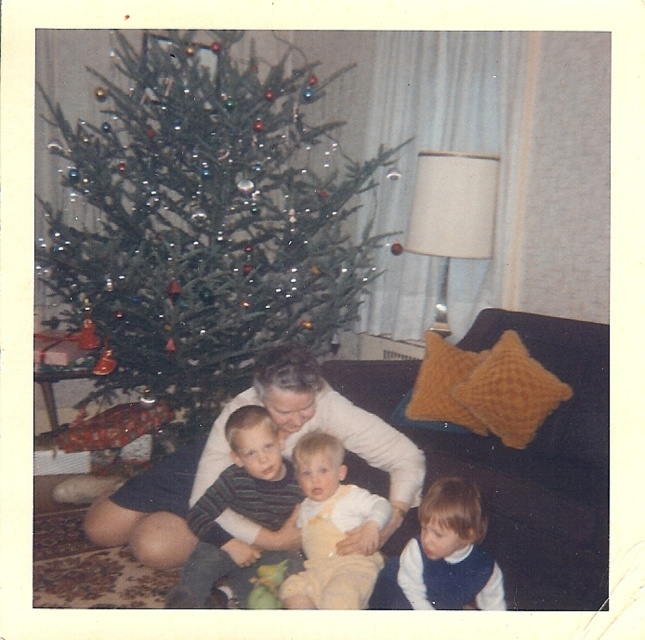
Question: Which point is farther from the camera taking this photo?

Choices:
 (A) (439, 545)
 (B) (335, 531)
 (C) (146, 189)

Answer: (C)

Question: Among these objects, which one is nearest to the camera?

Choices:
 (A) striped cotton shirt at center
 (B) green matte christmas tree at upper left
 (C) yellow cotton onesie at center

Answer: (C)

Question: Is dark brown fabric couch at center smaller than striped cotton shirt at center?

Choices:
 (A) yes
 (B) no

Answer: (B)

Question: Which of the following is the farthest from the observer?

Choices:
 (A) (401, 550)
 (B) (573, 486)
 (C) (177, 589)

Answer: (A)

Question: Is dark brown fabric couch at center to the right of yellow cotton onesie at center from the viewer's perspective?

Choices:
 (A) yes
 (B) no

Answer: (A)

Question: Considering the relative positions of green matte christmas tree at upper left and yellow cotton onesie at center in the image provided, where is green matte christmas tree at upper left located with respect to yellow cotton onesie at center?

Choices:
 (A) above
 (B) below

Answer: (A)